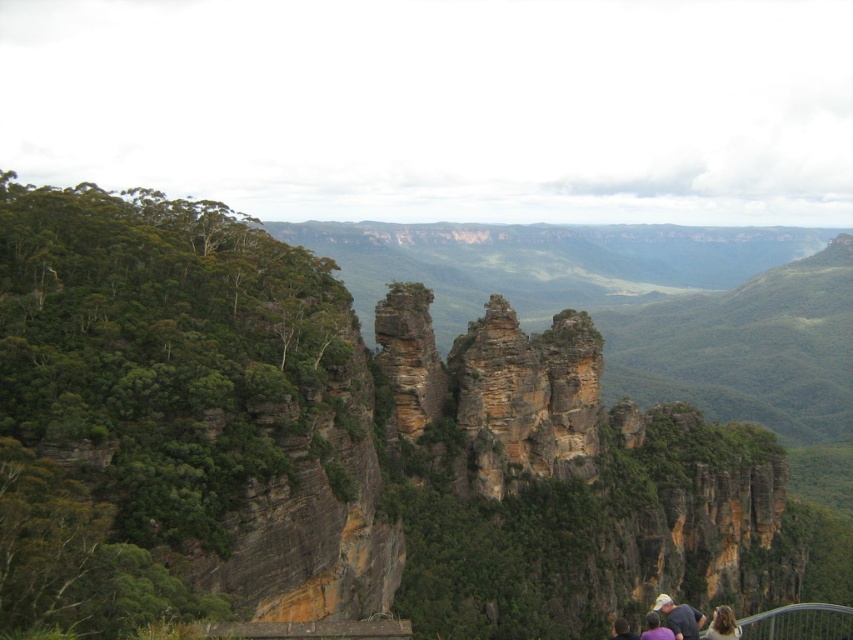
You are a hiker standing at the base of the rugged rock formation at center. You want to climb to the top. If your average climbing speed is 0.5 meters per second, how many minutes will it take you to reach the top?

The rugged rock formation at center and viewer are 44.42 meters apart. At a speed of 0.5 meters per second, it would take 44.42 divided by 0.5 equals 88.84 seconds, which is approximately 1.48 minutes. So, it will take roughly 1.5 minutes to reach the top.

You are a geologist studying the Three Sisters rock formations in the Blue Mountains National Park. You have a map with coordinates that indicate a specific point of interest. According to the map, where exactly is the rugged rock formation at center located?

The rugged rock formation at center is located at coordinates point (337, 445).

You are a hiker standing at the base of the rugged rock formation at center and want to reach the blonde hair at lower right. Which direction should you move to get there?

To reach the blonde hair at lower right from the rugged rock formation at center, you should move to the right since the blonde hair at lower right is located to the right of the rugged rock formation at center.